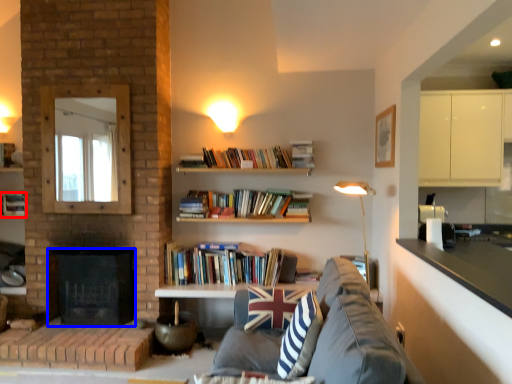
Question: Which point is closer to the camera, book (highlighted by a red box) or fireplace (highlighted by a blue box)?

Choices:
 (A) book
 (B) fireplace

Answer: (B)